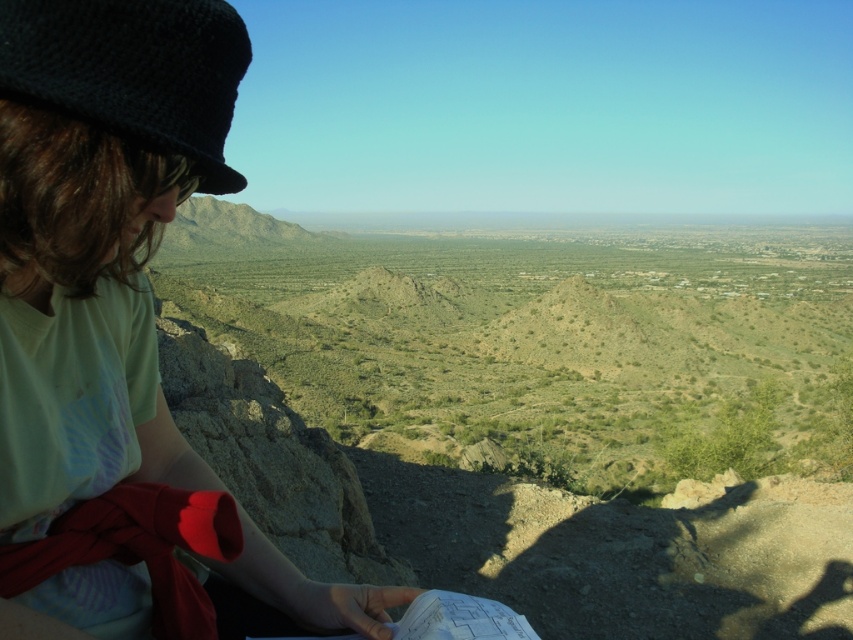
You are a photographer trying to capture the exact location of the matte black hat at upper left in the image. According to the coordinates provided, where should you focus your camera lens to ensure the hat is centered in the frame?

The matte black hat at upper left is located at coordinates point (x=97, y=234), so you should focus your camera lens at that specific coordinate point to center the hat in the frame.

You are a photographer trying to capture a clear shot of the person in the image. The two hats, matte black hat at upper left and black knitted hat at upper left, are partially blocking your view. Which hat should you move to get a better view of the person?

The matte black hat at upper left is shorter than the black knitted hat at upper left, so moving the black knitted hat at upper left would provide a better view since it is taller and blocking more of the sightline.

You are a photographer trying to capture the person in the scene. The person is wearing two hats, the matte black hat at upper left and the black knitted hat at upper left. Which hat will appear closer to the camera in your photo?

The matte black hat at upper left will appear closer to the camera because the black knitted hat at upper left is behind it.